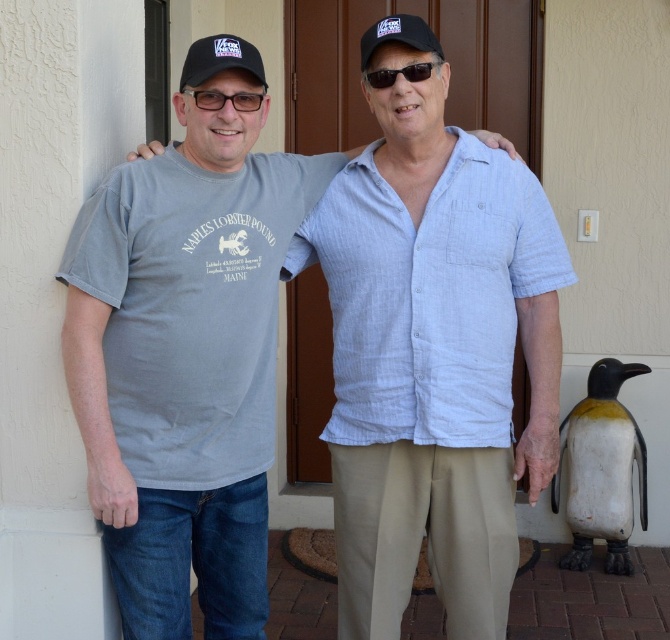
Who is shorter, white matte penguin at lower right or black fabric baseball cap at upper center?

With less height is black fabric baseball cap at upper center.

Between point (563, 451) and point (387, 19), which one is positioned behind?

The point (563, 451) is behind.

Does point (641, 477) come in front of point (381, 44)?

No.

The image size is (670, 640). I want to click on white matte penguin at lower right, so click(602, 468).

Who is higher up, black fabric baseball cap at upper left or black fabric baseball cap at upper center?

black fabric baseball cap at upper center

Which of these two, black fabric baseball cap at upper left or black fabric baseball cap at upper center, stands shorter?

Standing shorter between the two is black fabric baseball cap at upper center.

Is point (194, 58) closer to camera compared to point (407, 33)?

Yes.

Image resolution: width=670 pixels, height=640 pixels. In order to click on black fabric baseball cap at upper left in this screenshot , I will do [x=218, y=60].

Is black fabric baseball cap at upper left taller than matte plastic glasses at upper center?

Yes, black fabric baseball cap at upper left is taller than matte plastic glasses at upper center.

You are a GUI agent. You are given a task and a screenshot of the screen. Output one action in this format:
    pyautogui.click(x=<x>, y=<y>)
    Task: Click on the black fabric baseball cap at upper left
    
    Given the screenshot: What is the action you would take?
    pyautogui.click(x=218, y=60)

Between point (204, 51) and point (210, 106), which one is positioned in front?

Positioned in front is point (204, 51).

Find the location of a particular element. The width and height of the screenshot is (670, 640). black fabric baseball cap at upper left is located at coordinates (218, 60).